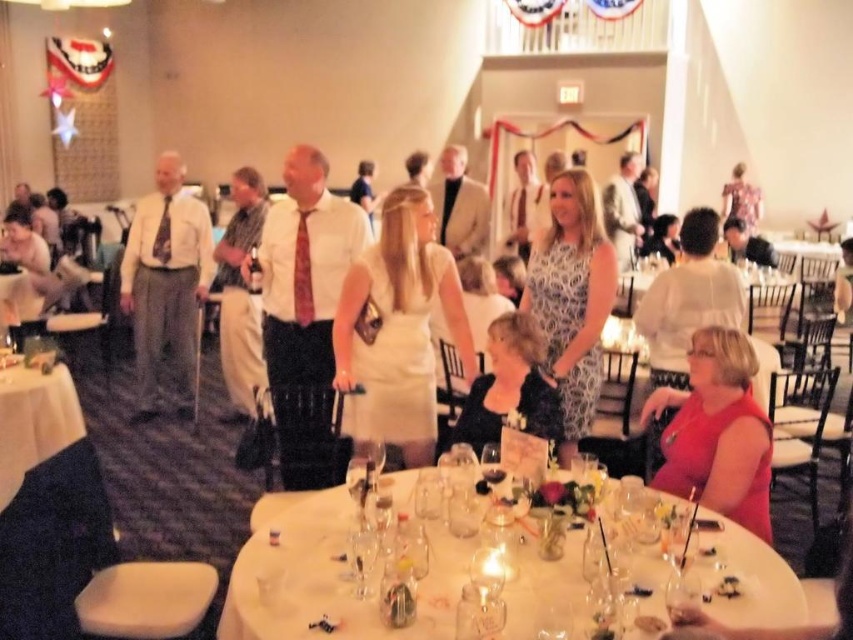
Question: Among these objects, which one is farthest from the camera?

Choices:
 (A) pink satin tie at center
 (B) white glossy table at lower center

Answer: (A)

Question: Where is matte red dress at lower right located in relation to black satin dress at center in the image?

Choices:
 (A) right
 (B) left

Answer: (A)

Question: Can you confirm if white tablecloth at lower left is positioned to the left of light brown suit at center?

Choices:
 (A) no
 (B) yes

Answer: (B)

Question: Among these points, which one is farthest from the camera?

Choices:
 (A) (432, 193)
 (B) (296, 276)
 (C) (12, 406)
 (D) (206, 252)

Answer: (A)

Question: Which of the following is the closest to the observer?

Choices:
 (A) pink satin tie at center
 (B) matte red dress at lower right

Answer: (B)

Question: Does black satin dress at center come behind patterned silk tie at center?

Choices:
 (A) yes
 (B) no

Answer: (B)